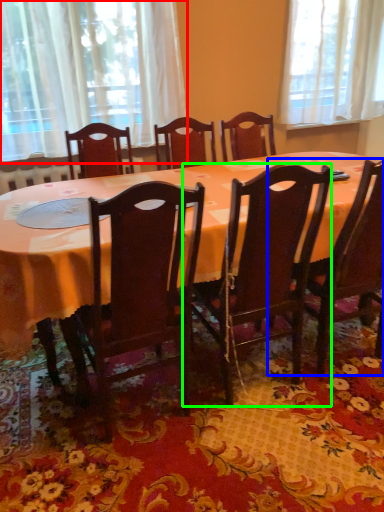
Question: Based on their relative distances, which object is nearer to curtain (highlighted by a red box)? Choose from chair (highlighted by a blue box) and chair (highlighted by a green box).

Choices:
 (A) chair
 (B) chair

Answer: (B)